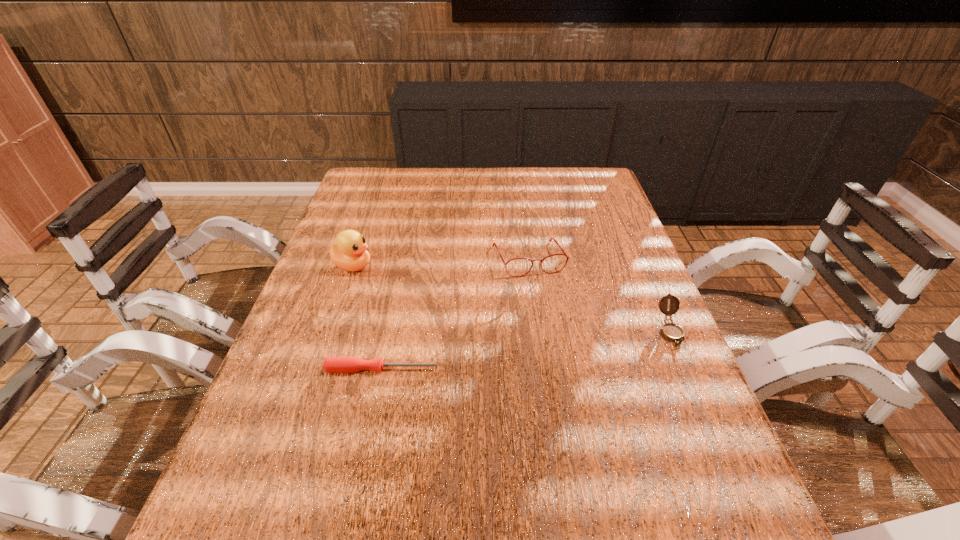
What are the coordinates of `screwdriver` in the screenshot? It's located at (331, 364).

Find the location of a particular element. Image resolution: width=960 pixels, height=540 pixels. the nearest object is located at coordinates (331, 364).

I want to click on compass, so click(x=672, y=332).

Find the location of a particular element. Image resolution: width=960 pixels, height=540 pixels. the second nearest object is located at coordinates (672, 332).

Identify the location of the third object from left to right. This screenshot has height=540, width=960. (564, 254).

Find the location of a particular element. The height and width of the screenshot is (540, 960). duckling is located at coordinates (350, 253).

Find the location of `free location located at the tip of the nearest object`. free location located at the tip of the nearest object is located at coordinates (608, 369).

The image size is (960, 540). Identify the location of vacant space positioned 0.220m on the face of the compass. (719, 442).

Where is `vacant region located 0.160m on the face of the second object from right to left`? vacant region located 0.160m on the face of the second object from right to left is located at coordinates (555, 322).

The height and width of the screenshot is (540, 960). I want to click on vacant point located 0.320m on the face of the second object from right to left, so click(578, 376).